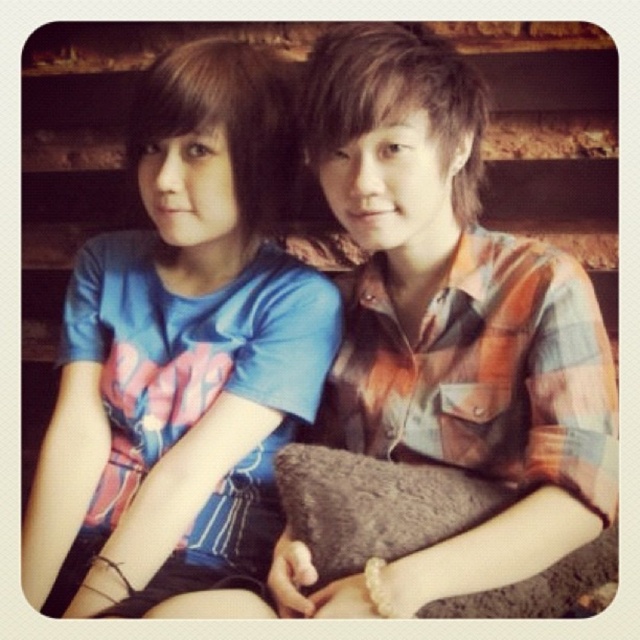
Where is `plaid shirt at center`? This screenshot has width=640, height=640. plaid shirt at center is located at coordinates (445, 330).

Between point (406, 413) and point (301, 454), which one is positioned in front?

Positioned in front is point (301, 454).

I want to click on plaid shirt at center, so click(x=445, y=330).

The height and width of the screenshot is (640, 640). I want to click on plaid shirt at center, so click(x=445, y=330).

Which of these two, plaid shirt at center or blue cotton t-shirt at upper left, stands taller?

Standing taller between the two is blue cotton t-shirt at upper left.

Who is more distant from viewer, (442, 193) or (195, 368)?

Positioned behind is point (195, 368).

Find the location of `plaid shirt at center`. plaid shirt at center is located at coordinates (445, 330).

Who is shorter, blue cotton t-shirt at upper left or brown fuzzy pillow at center?

brown fuzzy pillow at center is shorter.

Who is positioned more to the left, blue cotton t-shirt at upper left or brown fuzzy pillow at center?

blue cotton t-shirt at upper left is more to the left.

Is point (196, 552) behind point (355, 564)?

That is True.

Identify the location of blue cotton t-shirt at upper left. (182, 344).